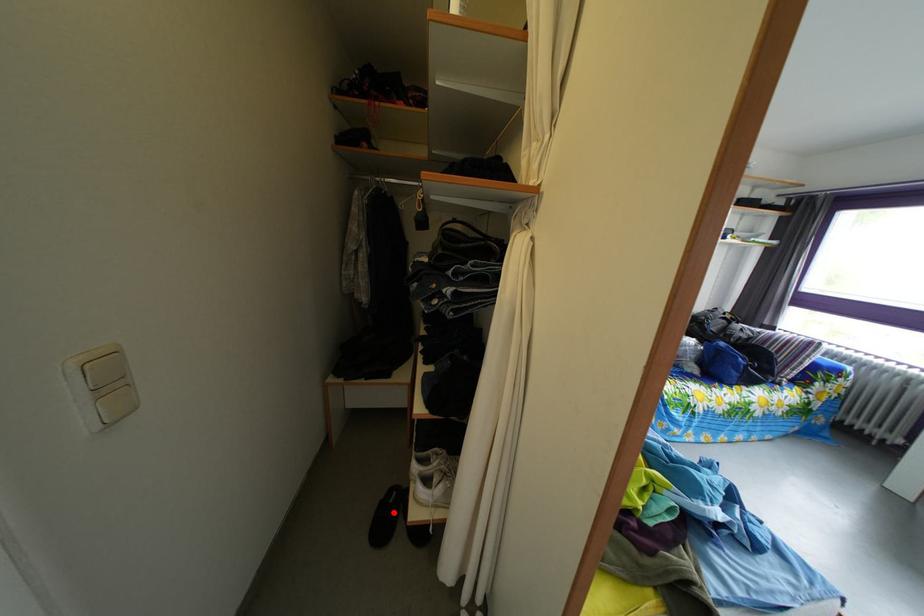
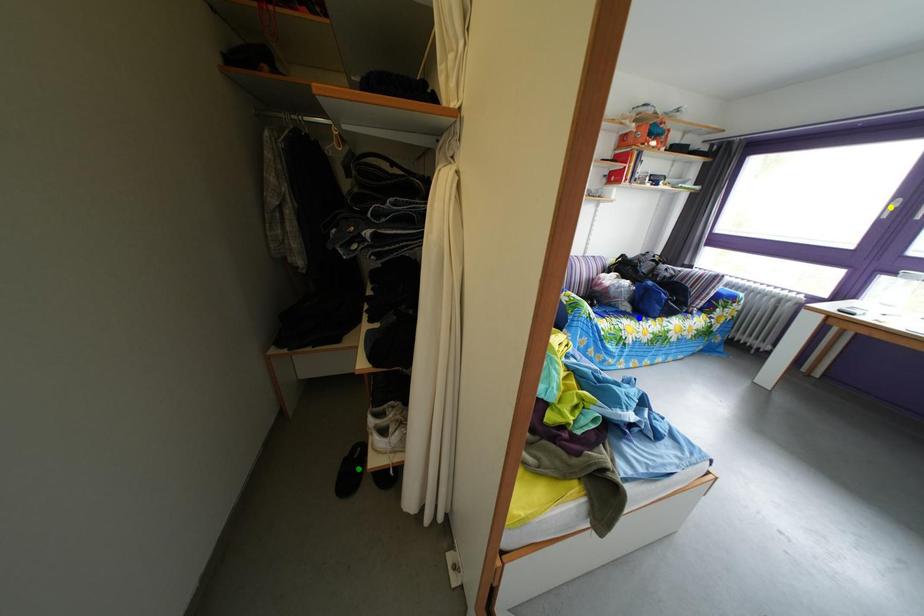
Question: I am providing you with two images of the same scene from different viewpoints. A red point is marked on the first image. You are given multiple points on the second image. Which point in image 2 represents the same 3d spot as the red point in image 1?

Choices:
 (A) green point
 (B) yellow point
 (C) blue point

Answer: (A)